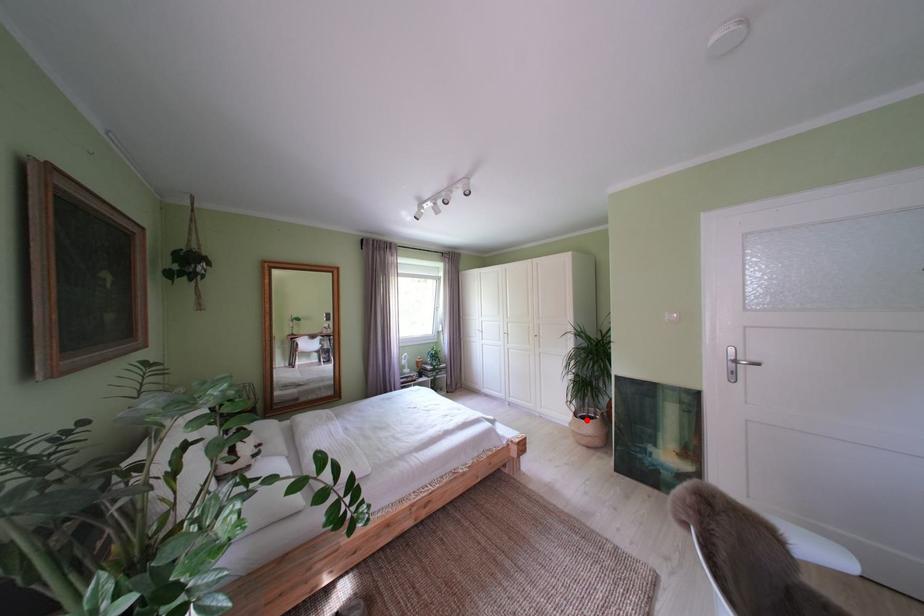
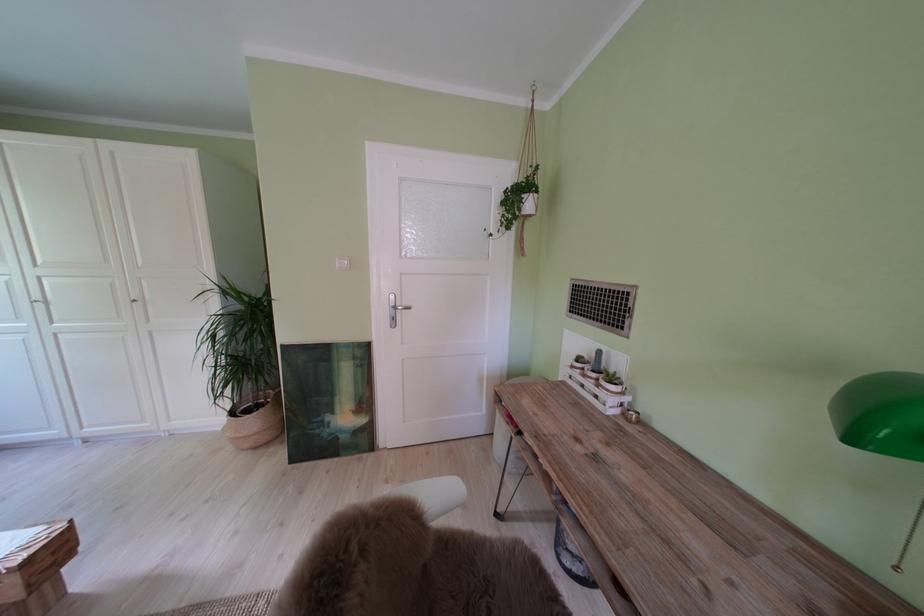
Question: I am providing you with two images of the same scene from different viewpoints. A red point is shown in image1. For the corresponding object point in image2, is it positioned nearer or farther from the camera?

Choices:
 (A) Nearer
 (B) Farther

Answer: (A)